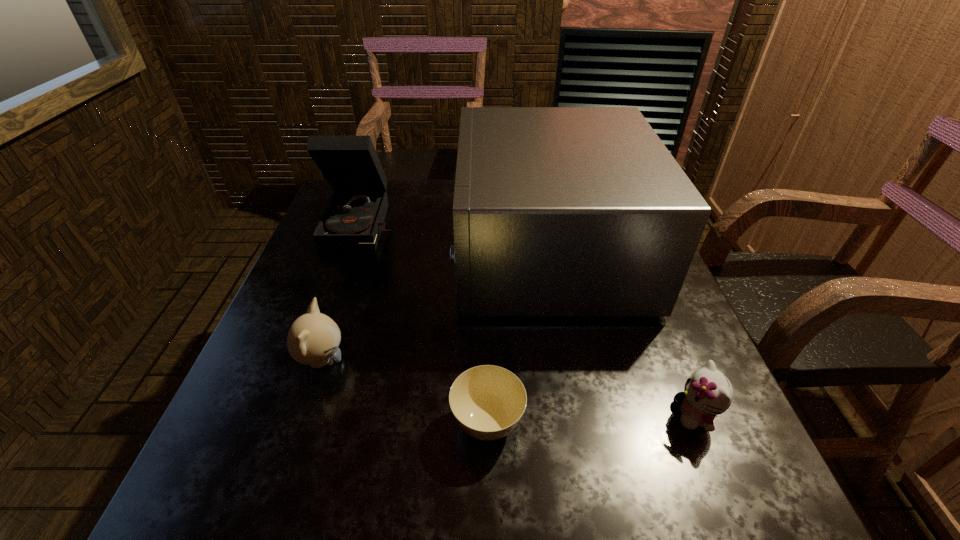
Locate an element on the screen. This screenshot has width=960, height=540. free spot between the microwave oven and the farther kitten is located at coordinates (435, 306).

Where is `free spot between the farther kitten and the phonograph_record`? This screenshot has height=540, width=960. free spot between the farther kitten and the phonograph_record is located at coordinates (343, 292).

The height and width of the screenshot is (540, 960). I want to click on vacant space that's between the third nearest object and the sugar bowl, so click(x=404, y=392).

You are a GUI agent. You are given a task and a screenshot of the screen. Output one action in this format:
    pyautogui.click(x=<x>, y=<y>)
    Task: Click on the vacant area between the third farthest object and the phonograph_record
    The image size is (960, 540).
    Given the screenshot: What is the action you would take?
    pyautogui.click(x=343, y=292)

Locate an element on the screen. The height and width of the screenshot is (540, 960). empty space that is in between the phonograph_record and the nearer kitten is located at coordinates [529, 319].

Locate an element on the screen. object that can be found as the closest to the nearer kitten is located at coordinates (558, 211).

Select which object is the closest to the phonograph_record. Please provide its 2D coordinates. Your answer should be formatted as a tuple, i.e. [(x, y)], where the tuple contains the x and y coordinates of a point satisfying the conditions above.

[(558, 211)]

Where is `vacant point that satisfies the following two spatial constraints: 1. on the back side of the sugar bowl; 2. on the face of the left kitten`? The image size is (960, 540). vacant point that satisfies the following two spatial constraints: 1. on the back side of the sugar bowl; 2. on the face of the left kitten is located at coordinates (487, 361).

Locate an element on the screen. The width and height of the screenshot is (960, 540). free space that satisfies the following two spatial constraints: 1. on the front-facing side of the phonograph_record; 2. on the left side of the shortest object is located at coordinates (294, 423).

Locate an element on the screen. vacant space that satisfies the following two spatial constraints: 1. on the front-facing side of the sugar bowl; 2. on the right side of the phonograph_record is located at coordinates (294, 423).